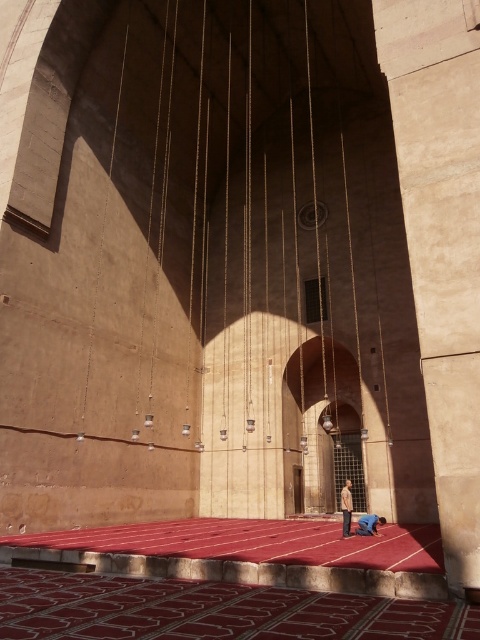
You are a visitor in the mosque and want to place your brown leather jacket at center on a sandy beige stone pillar at right. Is the pillar tall enough to support the jacket without it touching the floor?

The sandy beige stone pillar at right has a greater height compared to brown leather jacket at center. Therefore, the pillar is tall enough to support the jacket without it touching the floor.

You are standing in the grand mosque and notice two points marked on the floor. The first point is at coordinates point (472, 12) and the second is at point (380, 522). Which point is closer to you?

Point (472, 12) is closer to the viewer than point (380, 522).